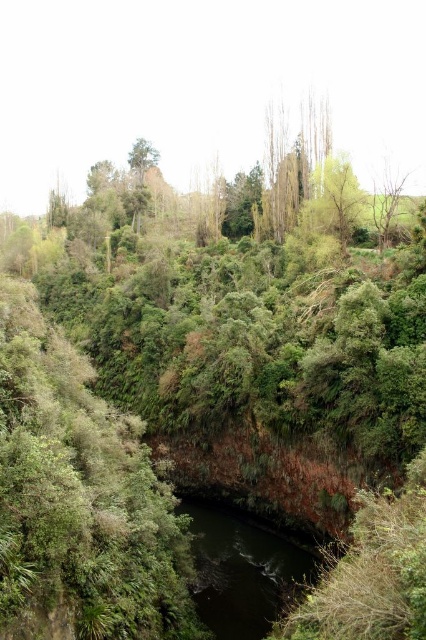
You are standing in the lush landscape and want to place a small flag at each of the two points, point [259,541] and point [140,166]. Which point is closer to you where you can place the flag without needing to move further into the scene?

Point [259,541] is closer to the viewer than point [140,166], so you can place the flag there without moving further into the scene.

You are an explorer navigating through this landscape. You see the dark green water at center and the green matte tree at upper center. Which object is positioned to the right of the other?

The dark green water at center is to the right of the green matte tree at upper center.

You are a hiker standing at the edge of the dark green water at center. You want to throw a pebble into the water. Considering the distance from where you are standing to the water, will the pebble reach the water if you throw it with a maximum throw distance of 30 meters?

The dark green water at center is 31.82 meters from camera. Since your maximum throw distance is 30 meters, the pebble will not reach the water.